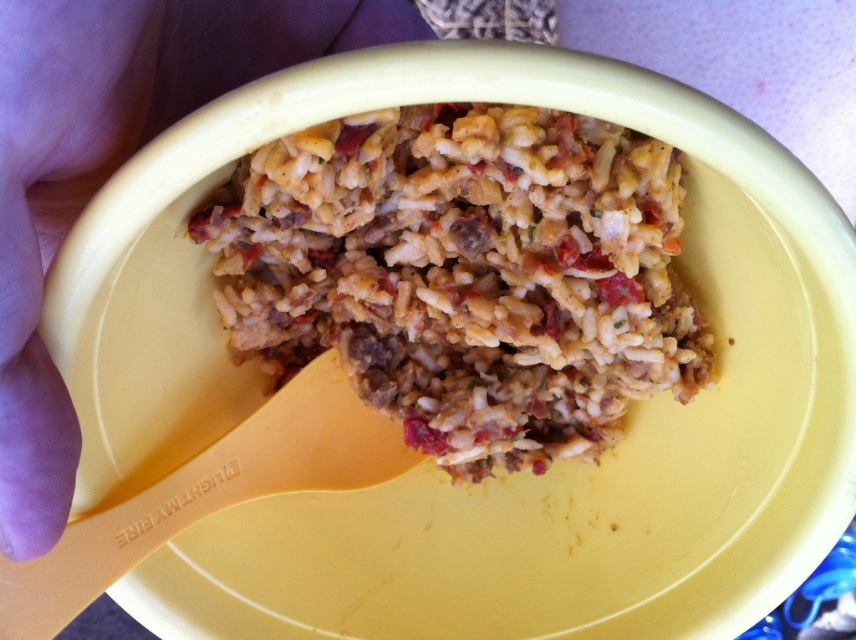
Question: Does brown matte rice at center come behind yellow plastic spoon at lower left?

Choices:
 (A) yes
 (B) no

Answer: (A)

Question: Does brown matte rice at center have a smaller size compared to light skin at left?

Choices:
 (A) no
 (B) yes

Answer: (A)

Question: Is light skin at left to the right of yellow plastic spoon at lower left from the viewer's perspective?

Choices:
 (A) yes
 (B) no

Answer: (B)

Question: Which object is the farthest from the light skin at left?

Choices:
 (A) brown matte rice at center
 (B) yellow plastic spoon at lower left

Answer: (B)

Question: Which object appears farthest from the camera in this image?

Choices:
 (A) light skin at left
 (B) yellow plastic spoon at lower left

Answer: (B)

Question: Which of the following is the closest to the observer?

Choices:
 (A) (34, 540)
 (B) (16, 616)

Answer: (A)